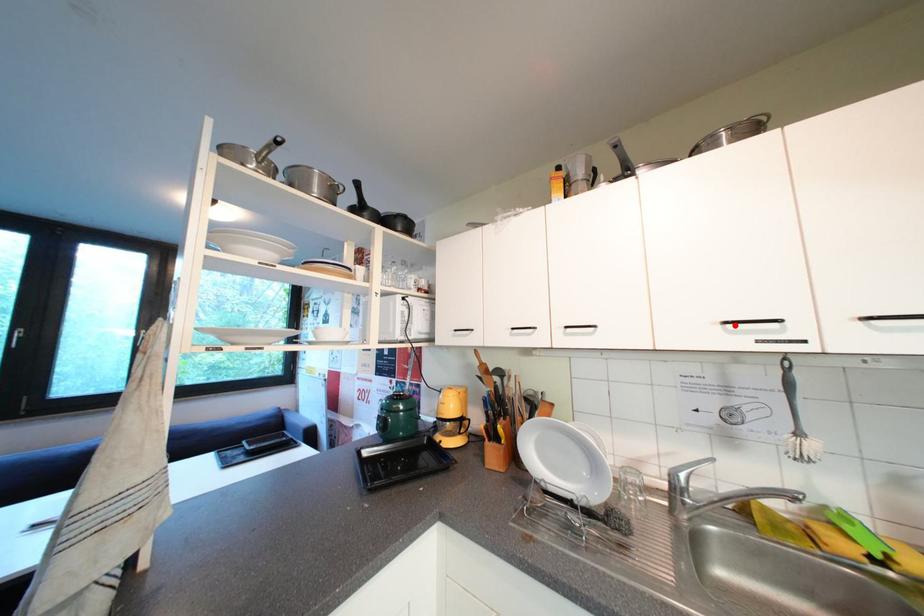
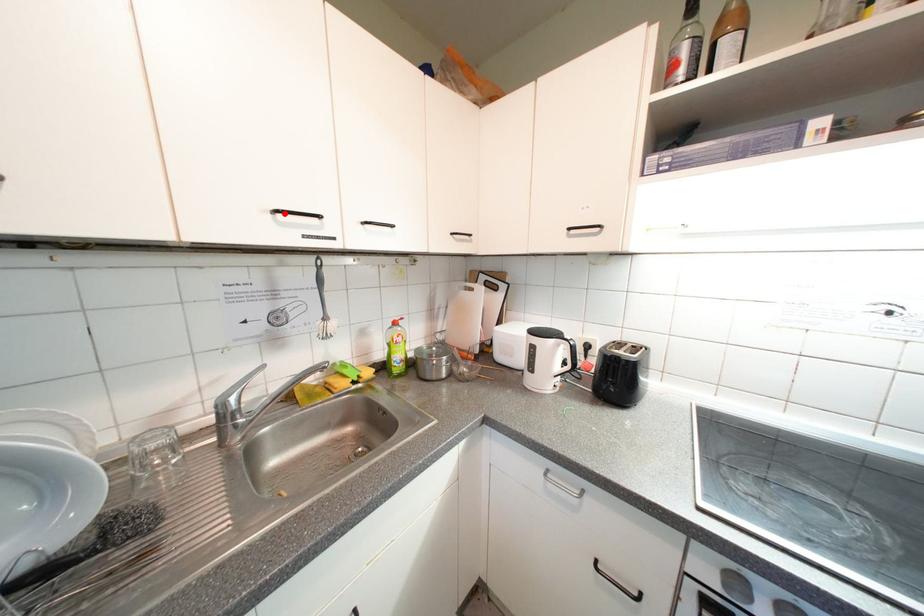
I am providing you with two images of the same scene from different viewpoints. A red point is marked on the first image and another point is marked on the second image. Are the points marked in image1 and image2 representing the same 3D position?

Yes